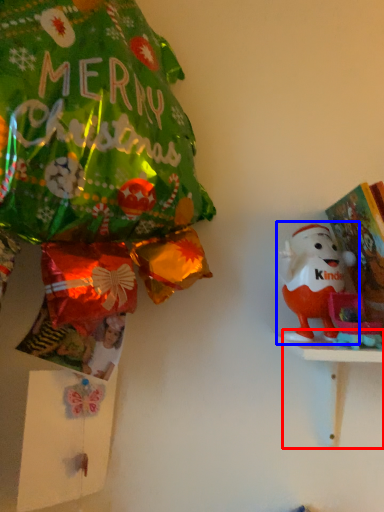
Question: Which object is further to the camera taking this photo, table (highlighted by a red box) or toy (highlighted by a blue box)?

Choices:
 (A) table
 (B) toy

Answer: (B)